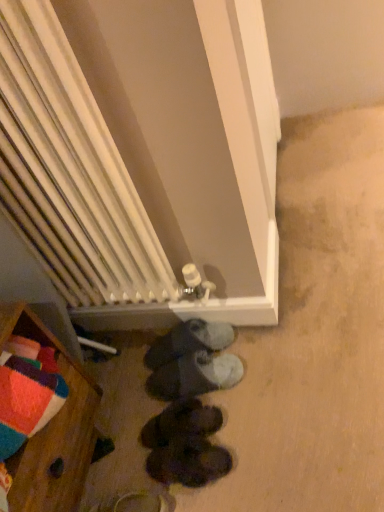
Question: From the image's perspective, is dark gray suede shoes at center, arranged as the third footwear when ordered from the bottom, located above or below black suede shoes at lower center, the 3th footwear when ordered from top to bottom?

Choices:
 (A) above
 (B) below

Answer: (A)

Question: Is dark gray suede shoes at center, placed as the second footwear when sorted from top to bottom, to the left or to the right of black suede shoes at lower center, the 3th footwear when ordered from top to bottom, in the image?

Choices:
 (A) left
 (B) right

Answer: (B)

Question: Estimate the real-world distances between objects in this image. Which object is farther from the dark gray suede shoes at center, arranged as the third footwear when ordered from the bottom?

Choices:
 (A) wooden chest of drawers at lower left
 (B) black suede shoes at lower center, which appears as the 2th footwear when ordered from the bottom
 (C) white radiator at center
 (D) black suede shoes at lower center, positioned as the 1th footwear in top-to-bottom order
 (E) dark brown leather shoes at center, which ranks as the first footwear in bottom-to-top order

Answer: (C)

Question: Based on their relative distances, which object is farther from the black suede shoes at lower center, positioned as the 1th footwear in top-to-bottom order?

Choices:
 (A) black suede shoes at lower center, the 3th footwear when ordered from top to bottom
 (B) white radiator at center
 (C) dark gray suede shoes at center, placed as the second footwear when sorted from top to bottom
 (D) dark brown leather shoes at center, the fourth footwear when ordered from top to bottom
 (E) wooden chest of drawers at lower left

Answer: (B)